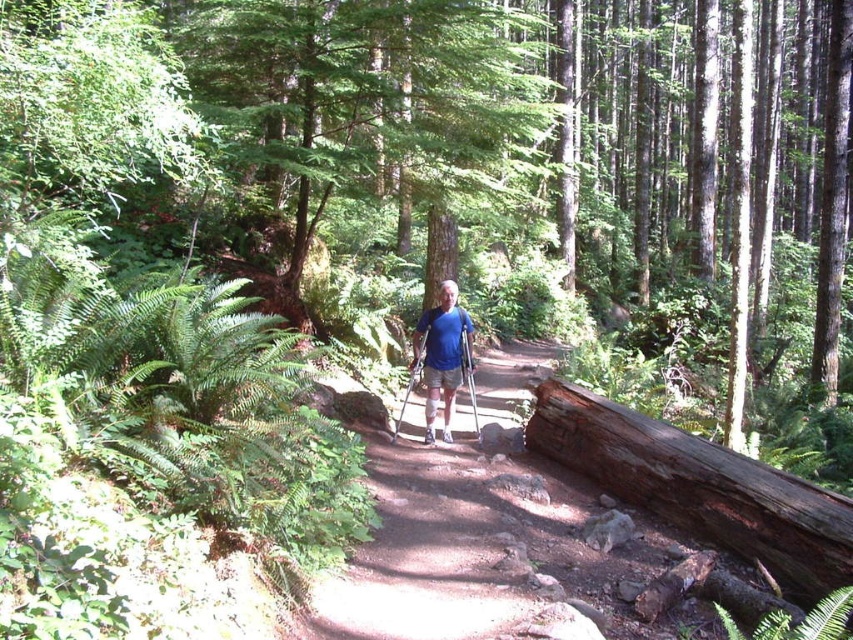
Can you confirm if weathered brown log at right is positioned below blue fabric shirt at center?

Indeed, weathered brown log at right is positioned under blue fabric shirt at center.

Can you confirm if weathered brown log at right is bigger than blue fabric shirt at center?

Yes.

You are a GUI agent. You are given a task and a screenshot of the screen. Output one action in this format:
    pyautogui.click(x=<x>, y=<y>)
    Task: Click on the weathered brown log at right
    The height and width of the screenshot is (640, 853).
    Given the screenshot: What is the action you would take?
    pyautogui.click(x=699, y=486)

The image size is (853, 640). I want to click on weathered brown log at right, so click(x=699, y=486).